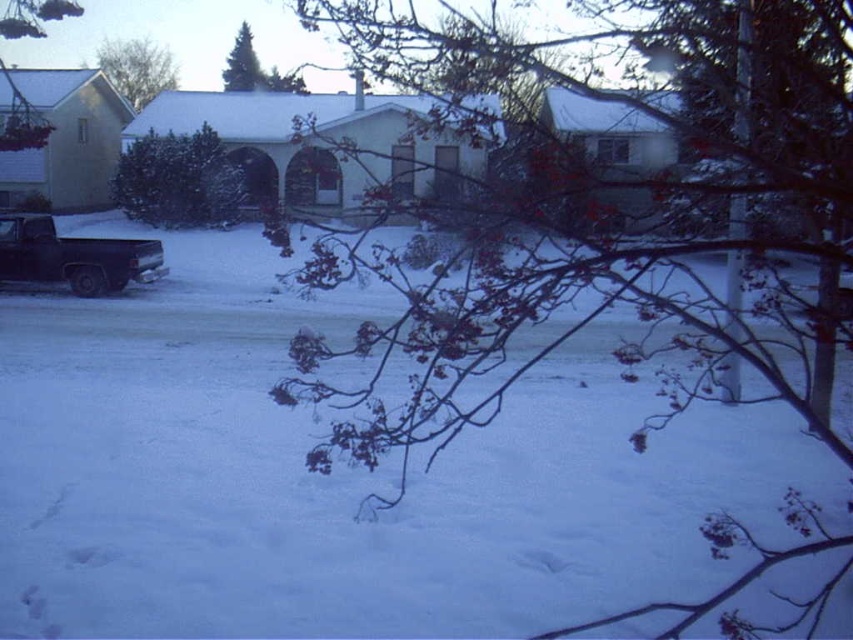
You are a delivery person trying to deliver a package to the house with the covered porch. You see the bare branches at center and the green matte evergreen tree at upper center in your way. Which obstacle is closer to you as you approach the house?

The bare branches at center is closer to you because it is in front of the green matte evergreen tree at upper center.

You are standing in the winter scene and want to take a photo of the house with the bare branches in the foreground. Where should you position yourself to include both the house and the bare branches at center at point (589,220) in the frame?

You should position yourself at a vantage point where the bare branches at center at point (589,220) are in the foreground, framing the house behind them. This positioning ensures both elements are captured within the camera frame.